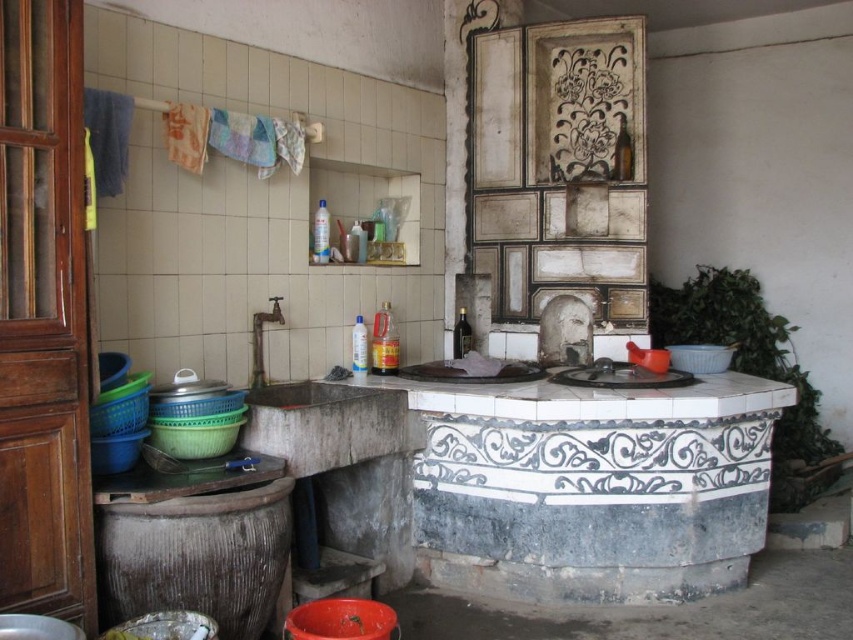
You are a person who wants to sit on the orange plastic stool at lower center while using the rusty metal sink at center. Can you comfortably do so, considering their heights?

The rusty metal sink at center is much taller than the orange plastic stool at lower center, so sitting on the stool while using the sink may be uncomfortable due to the height difference.

You are standing in the kitchen and want to place a small bowl on the counter between the rusty metal sink at center and the orange plastic stool at lower center. Which object should you place it closer to if you want the bowl to be as close as possible to the viewer?

You should place the bowl closer to the rusty metal sink at center because it is closer to the viewer than the orange plastic stool at lower center, so positioning the bowl near it will make it more visible from your current position.